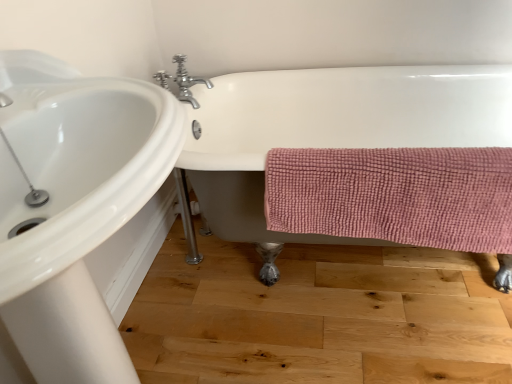
Question: Based on their positions, is white glossy bathtub at center located to the left or right of pink textured towel at lower right?

Choices:
 (A) left
 (B) right

Answer: (B)

Question: In the image, is white glossy bathtub at center positioned in front of or behind pink textured towel at lower right?

Choices:
 (A) front
 (B) behind

Answer: (A)

Question: Considering the real-world distances, which object is farthest from the chrome metallic faucet at upper center?

Choices:
 (A) pink textured towel at lower right
 (B) white glossy bathtub at center
 (C) white glossy sink at upper left

Answer: (C)

Question: Which object is positioned farthest from the chrome metallic faucet at upper center?

Choices:
 (A) pink textured towel at lower right
 (B) white glossy sink at upper left
 (C) white glossy bathtub at center

Answer: (B)